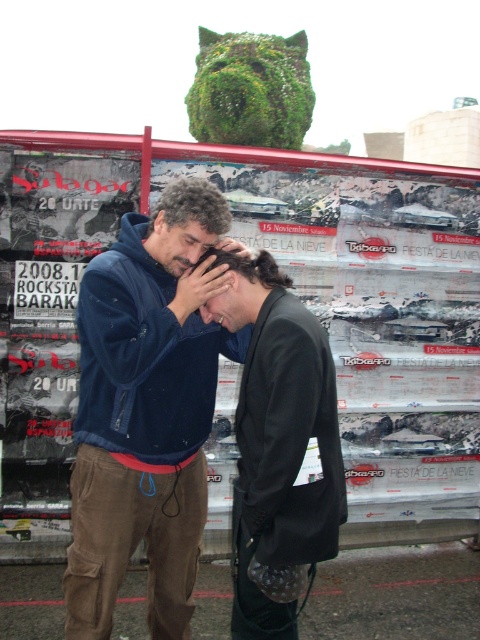
You are a photographer trying to focus on two points in the image. The first point is at coordinates point [310,444] and the second is at point [190,269]. Which point should you focus on first if you want to start with the one closer to you?

You should focus on point [310,444] first because it is closer to you than point [190,269] according to the description.

You are a photographer trying to capture a clear shot of the white paper posters at center and the dark blue fleece at center. Since the posters are partially obscured by the people, you want to know which object is wider so you can adjust your camera angle. Which one has a greater width?

The white paper posters at center has a greater width than the dark blue fleece at center, so you should adjust your camera angle to focus on the wider white paper posters at center.